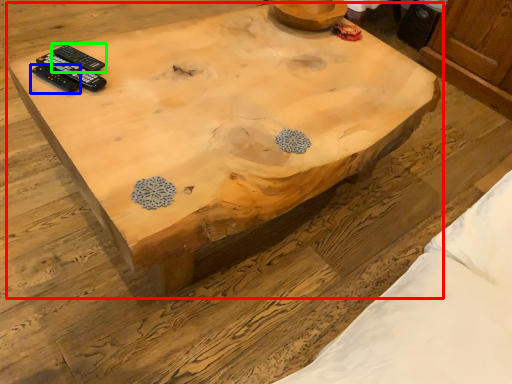
Question: Considering the real-world distances, which object is farthest from coffee table (highlighted by a red box)? remote control (highlighted by a blue box) or remote control (highlighted by a green box)?

Choices:
 (A) remote control
 (B) remote control

Answer: (A)